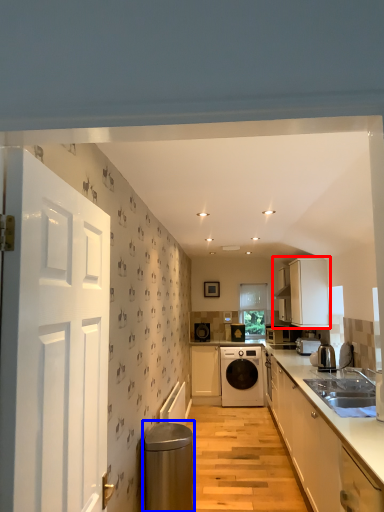
Question: Which object is further to the camera taking this photo, cabinetry (highlighted by a red box) or water heater (highlighted by a blue box)?

Choices:
 (A) cabinetry
 (B) water heater

Answer: (A)